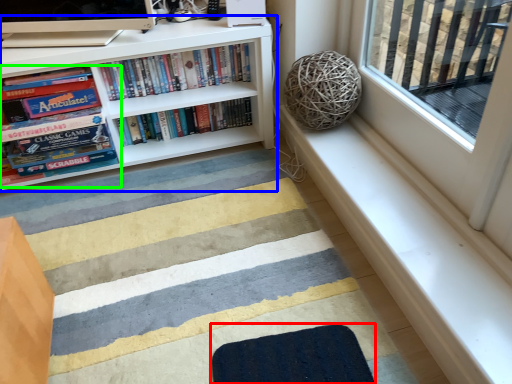
Question: Considering the real-world distances, which object is farthest from doormat (highlighted by a red box)? bookcase (highlighted by a blue box) or book (highlighted by a green box)?

Choices:
 (A) bookcase
 (B) book

Answer: (B)